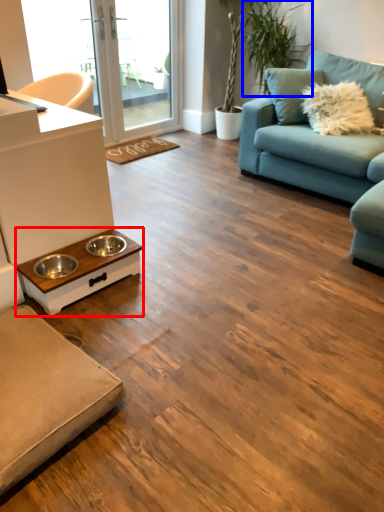
Question: Which object is further to the camera taking this photo, coffee table (highlighted by a red box) or plant (highlighted by a blue box)?

Choices:
 (A) coffee table
 (B) plant

Answer: (B)